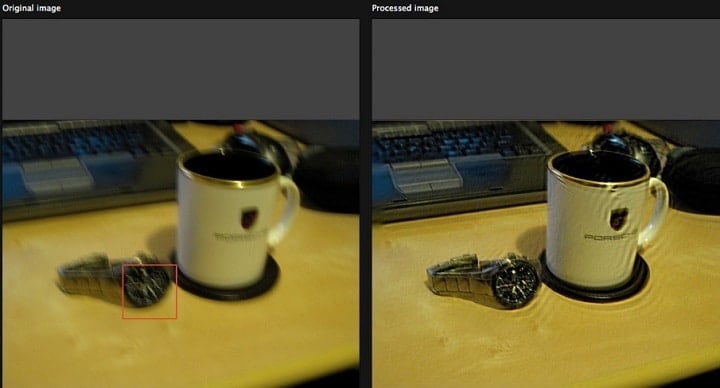
The image size is (720, 388). Find the location of `black coaster`. black coaster is located at coordinates (628, 288), (561, 284), (191, 282), (264, 275).